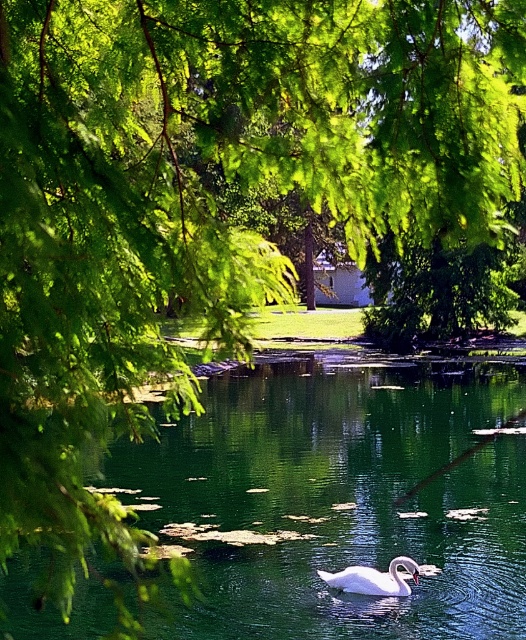
Question: Is the position of green glossy lake at center more distant than that of white glossy swan at center?

Choices:
 (A) yes
 (B) no

Answer: (B)

Question: Which point is farther from the camera taking this photo?

Choices:
 (A) (499, 426)
 (B) (342, 580)

Answer: (A)

Question: Is green glossy lake at center further to camera compared to white glossy swan at center?

Choices:
 (A) no
 (B) yes

Answer: (A)

Question: Is green glossy lake at center closer to camera compared to white glossy swan at center?

Choices:
 (A) no
 (B) yes

Answer: (B)

Question: Which of the following is the farthest from the observer?

Choices:
 (A) white glossy swan at center
 (B) green glossy lake at center

Answer: (A)